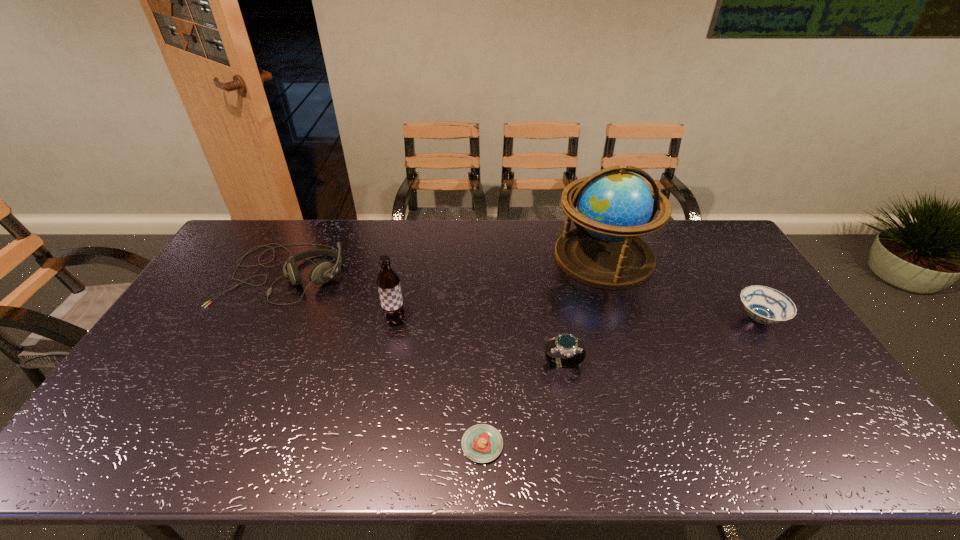
Identify the location of free space between the watch and the globe. (584, 310).

You are a GUI agent. You are given a task and a screenshot of the screen. Output one action in this format:
    pyautogui.click(x=<x>, y=<y>)
    Task: Click on the free space between the fifth shortest object and the globe
    The height and width of the screenshot is (540, 960).
    Given the screenshot: What is the action you would take?
    pyautogui.click(x=499, y=288)

Locate an element on the screen. vacant area that lies between the rightmost object and the root beer is located at coordinates click(577, 319).

Locate an element on the screen. vacant area between the root beer and the leftmost object is located at coordinates coord(340,296).

Find the location of a particular element. This screenshot has height=540, width=960. empty location between the second nearest object and the soup bowl is located at coordinates (661, 341).

Find the location of a particular element. vacant point located between the rightmost object and the watch is located at coordinates (x=661, y=341).

Choose which object is the second nearest neighbor to the second object from left to right. Please provide its 2D coordinates. Your answer should be formatted as a tuple, i.e. [(x, y)], where the tuple contains the x and y coordinates of a point satisfying the conditions above.

[(482, 443)]

Find the location of `object that is the fourth closest to the leftmost object`. object that is the fourth closest to the leftmost object is located at coordinates (615, 206).

You are a GUI agent. You are given a task and a screenshot of the screen. Output one action in this format:
    pyautogui.click(x=<x>, y=<y>)
    Task: Click on the vacant region that satisfies the following two spatial constraints: 1. on the back side of the shortest object; 2. on the left side of the rightmost object
    The width and height of the screenshot is (960, 540).
    Given the screenshot: What is the action you would take?
    pyautogui.click(x=482, y=318)

Find the location of a particular element. The width and height of the screenshot is (960, 540). free region that satisfies the following two spatial constraints: 1. on the outer surface of the watch; 2. on the right side of the headset is located at coordinates (239, 364).